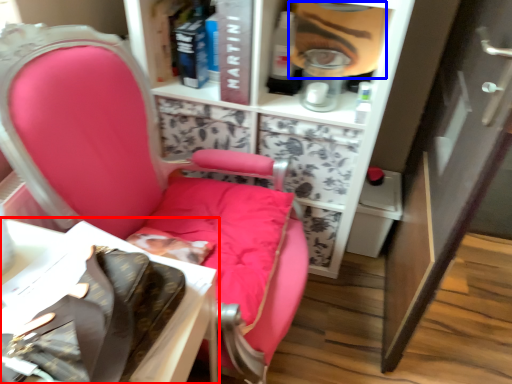
Question: Which point is further to the camera, table (highlighted by a red box) or person (highlighted by a blue box)?

Choices:
 (A) table
 (B) person

Answer: (B)